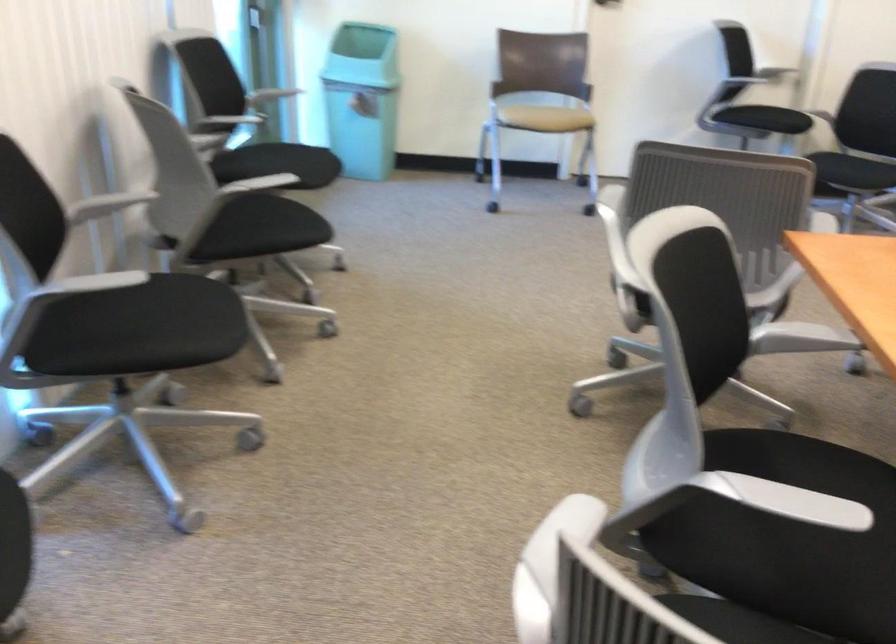
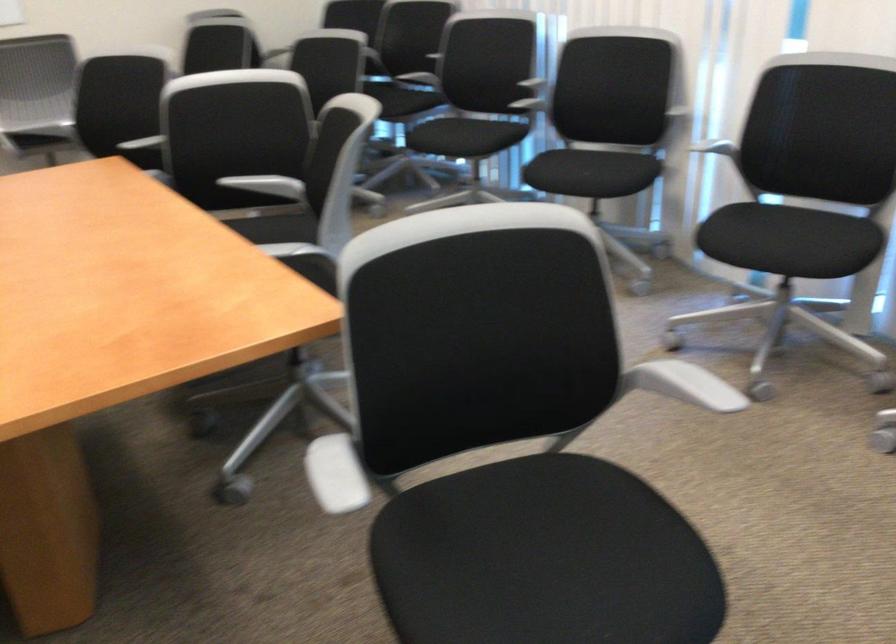
Where in the second image is the point corresponding to (x=767, y=238) from the first image?

(334, 474)